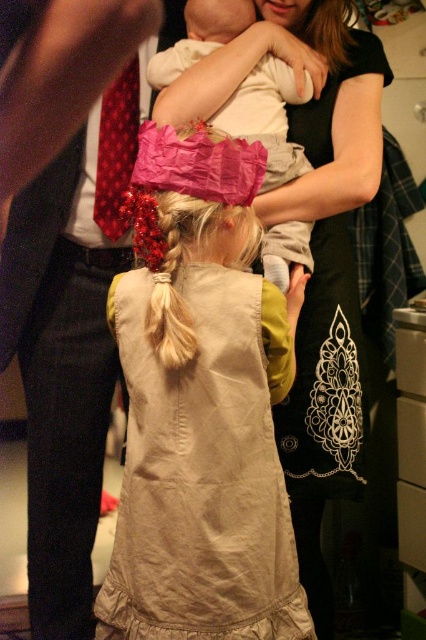
You are a photographer at a family event. You want to take a photo of the light beige fabric dress at center and the black cotton dress at center. Which dress is positioned in front of the other?

The light beige fabric dress at center is closer to the viewer than the black cotton dress at center, so it is positioned in front of the black cotton dress at center.

You are standing at the point labeled as point (293, 470) in the image. If you want to move closer to the viewer, which direction should you go?

Since the point (293, 470) is 4.37 feet away from the viewer, moving towards the direction facing away from the young girl with blonde hair styled in a braid adorned with red decorative elements would bring you closer to the viewer.

You are organizing a clothing donation drive and need to determine which of the two dresses at the center of the image can fit into a standard donation box that requires garments to be narrower than 30 cm. Given the light beige fabric dress at center and the black cotton dress at center, which dress would be eligible for donation?

The light beige fabric dress at center has a width less than the black cotton dress at center, so it would be eligible for donation as it meets the requirement of being narrower than 30 cm.